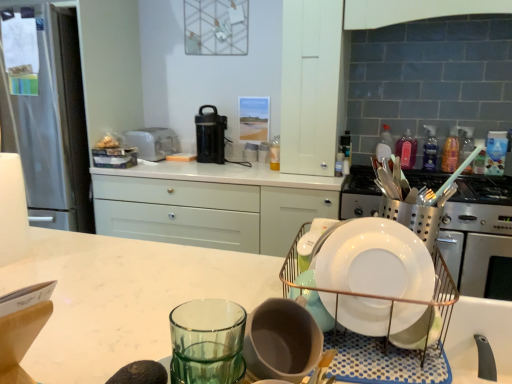
Question: From the image's perspective, is black plastic coffee maker at center located above or below pink plastic bottle at upper right, acting as the third bottle starting from the left?

Choices:
 (A) above
 (B) below

Answer: (A)

Question: Based on their sizes in the image, would you say black plastic coffee maker at center is bigger or smaller than pink plastic bottle at upper right, acting as the third bottle starting from the left?

Choices:
 (A) big
 (B) small

Answer: (A)

Question: Estimate the real-world distances between objects in this image. Which object is farther from the satin silver toaster at upper center?

Choices:
 (A) pink plastic bottle at upper right, the first bottle in the right-to-left sequence
 (B) translucent plastic bottle at upper right, the fourth bottle from the right
 (C) black plastic coffee maker at center
 (D) white ceramic sink at lower right
 (E) satin silver gas stove at right

Answer: (D)

Question: Estimate the real-world distances between objects in this image. Which object is farther from the white glossy plate at center?

Choices:
 (A) translucent plastic bottle at upper center, the first bottle from the left
 (B) satin silver gas stove at right
 (C) black plastic coffee maker at center
 (D) translucent plastic bottle at upper right, the fourth bottle from the right
 (E) white matte cabinet at upper center

Answer: (C)